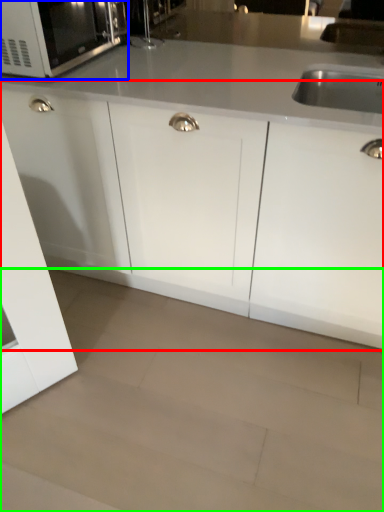
Question: Considering the real-world distances, which object is farthest from cabinetry (highlighted by a red box)? microwave oven (highlighted by a blue box) or granite (highlighted by a green box)?

Choices:
 (A) microwave oven
 (B) granite

Answer: (A)